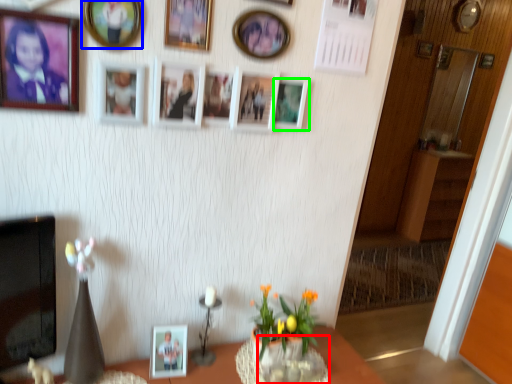
Question: Considering the real-world distances, which object is closest to glass vase (highlighted by a red box)? picture frame (highlighted by a blue box) or picture frame (highlighted by a green box).

Choices:
 (A) picture frame
 (B) picture frame

Answer: (B)